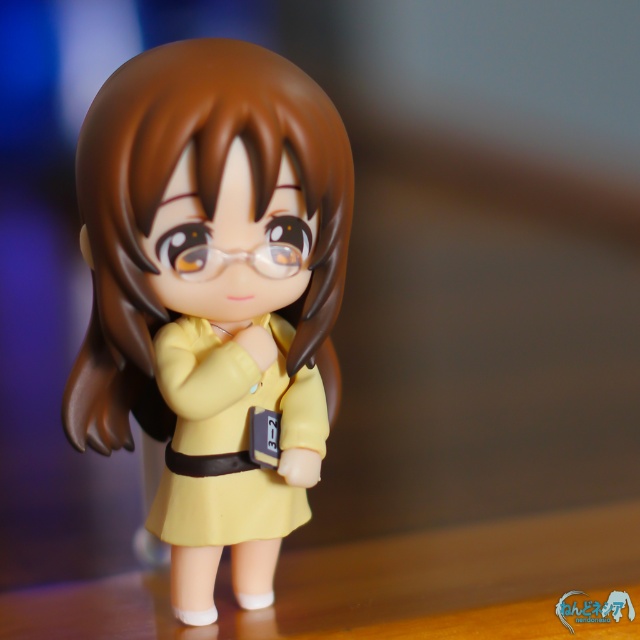
Question: Is matte yellow dress at center wider than yellow matte dress at center?

Choices:
 (A) yes
 (B) no

Answer: (A)

Question: Among these points, which one is nearest to the camera?

Choices:
 (A) (221, 385)
 (B) (220, 280)

Answer: (B)

Question: Which of the following is the closest to the observer?

Choices:
 (A) (241, 417)
 (B) (179, 96)

Answer: (B)

Question: From the image, what is the correct spatial relationship of matte yellow dress at center in relation to yellow matte dress at center?

Choices:
 (A) left
 (B) right

Answer: (A)

Question: Considering the relative positions of matte yellow dress at center and yellow matte dress at center in the image provided, where is matte yellow dress at center located with respect to yellow matte dress at center?

Choices:
 (A) right
 (B) left

Answer: (B)

Question: Which of the following is the farthest from the observer?

Choices:
 (A) (211, 356)
 (B) (76, 406)

Answer: (B)